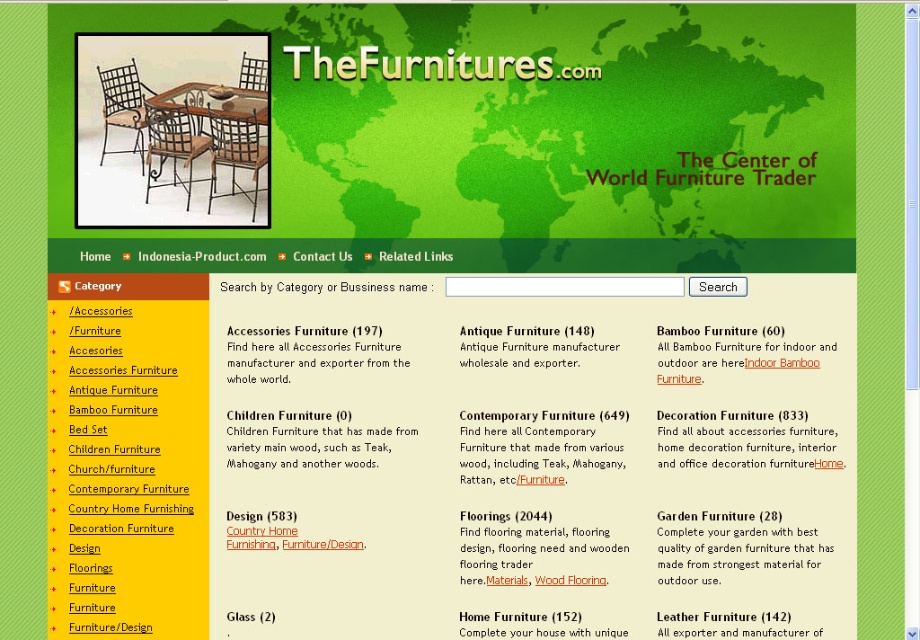
Question: Does black metal chair at center appear on the right side of metallic wrought iron chair at center?

Choices:
 (A) yes
 (B) no

Answer: (B)

Question: Can you confirm if black metal chair at center is wider than metallic wrought iron chair at center?

Choices:
 (A) no
 (B) yes

Answer: (A)

Question: Does matte black chair at center have a smaller size compared to black metal chair at center?

Choices:
 (A) no
 (B) yes

Answer: (A)

Question: Which of these objects is positioned farthest from the matte black chair at center?

Choices:
 (A) matte black metal chair at center
 (B) black metal chair at center

Answer: (B)

Question: Which object is farther from the camera taking this photo?

Choices:
 (A) black metal chair at center
 (B) matte black chair at center
 (C) metallic wrought iron chair at center
 (D) matte black metal chair at center

Answer: (B)

Question: Which object is positioned closest to the black metal chair at center?

Choices:
 (A) matte black metal chair at center
 (B) matte black chair at center

Answer: (A)